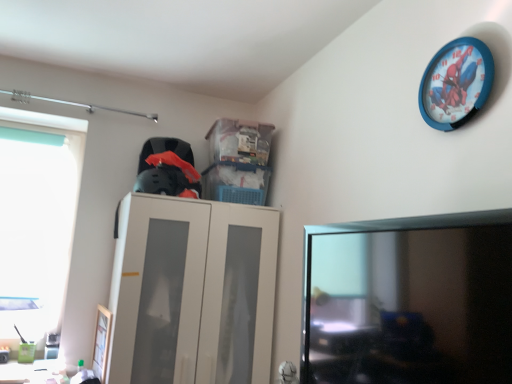
Question: Does blue plastic wall clock at upper right have a greater width compared to beige matte cabinet at center?

Choices:
 (A) no
 (B) yes

Answer: (A)

Question: Is blue plastic wall clock at upper right facing away from beige matte cabinet at center?

Choices:
 (A) no
 (B) yes

Answer: (A)

Question: From a real-world perspective, is blue plastic wall clock at upper right beneath beige matte cabinet at center?

Choices:
 (A) no
 (B) yes

Answer: (A)

Question: Is blue plastic wall clock at upper right thinner than beige matte cabinet at center?

Choices:
 (A) no
 (B) yes

Answer: (B)

Question: Is blue plastic wall clock at upper right smaller than beige matte cabinet at center?

Choices:
 (A) yes
 (B) no

Answer: (A)

Question: From the image's perspective, is blue plastic wall clock at upper right located beneath beige matte cabinet at center?

Choices:
 (A) yes
 (B) no

Answer: (B)

Question: Is the depth of blue plastic wall clock at upper right less than that of transparent plastic window at left?

Choices:
 (A) no
 (B) yes

Answer: (B)

Question: Is blue plastic wall clock at upper right aimed at transparent plastic window at left?

Choices:
 (A) no
 (B) yes

Answer: (A)

Question: Can you confirm if blue plastic wall clock at upper right is bigger than transparent plastic window at left?

Choices:
 (A) no
 (B) yes

Answer: (A)

Question: Can you confirm if blue plastic wall clock at upper right is positioned to the right of transparent plastic window at left?

Choices:
 (A) yes
 (B) no

Answer: (A)

Question: Does blue plastic wall clock at upper right have a lesser width compared to transparent plastic window at left?

Choices:
 (A) no
 (B) yes

Answer: (B)

Question: Is blue plastic wall clock at upper right oriented away from transparent plastic window at left?

Choices:
 (A) no
 (B) yes

Answer: (A)

Question: Is blue plastic wall clock at upper right positioned behind black glossy monitor at lower right?

Choices:
 (A) no
 (B) yes

Answer: (B)